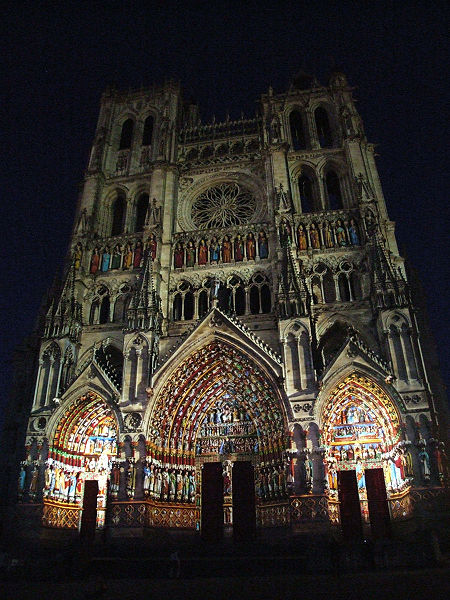
Find the location of a particular element. The image size is (450, 600). window is located at coordinates (177, 299).